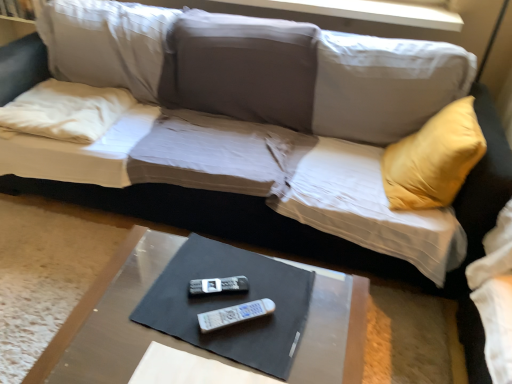
Image resolution: width=512 pixels, height=384 pixels. Find the location of `vacant area that lies in front of black plastic remote at center, the second remote when ordered from bottom to top`. vacant area that lies in front of black plastic remote at center, the second remote when ordered from bottom to top is located at coordinates (214, 341).